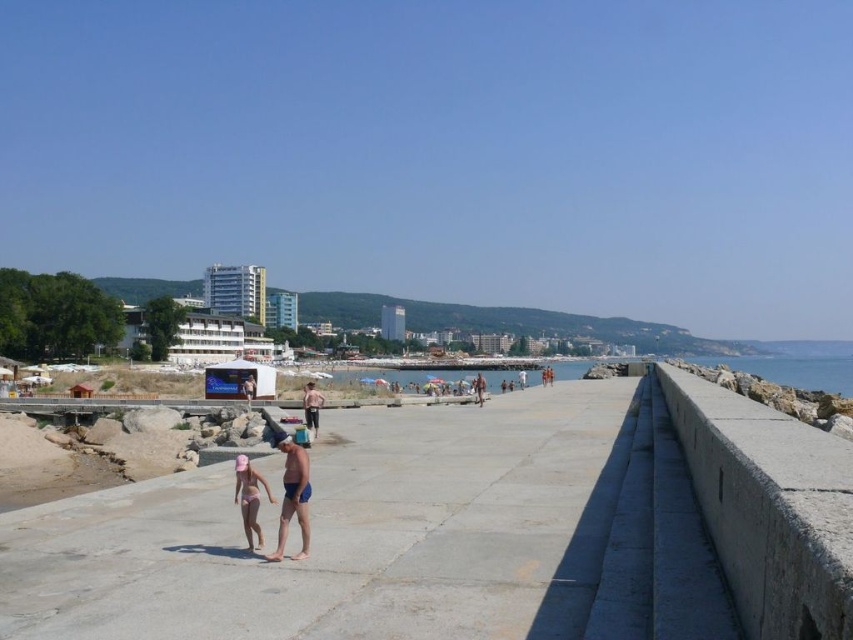
Question: Which of the following is the farthest from the observer?

Choices:
 (A) (299, 477)
 (B) (740, 362)

Answer: (B)

Question: Among these objects, which one is nearest to the camera?

Choices:
 (A) smooth tan skin at center
 (B) pink matte swimsuit at center
 (C) gray concrete ledge at center-right
 (D) smooth concrete pier at center

Answer: (C)

Question: Does smooth tan skin at center appear on the left side of smooth skin person at center?

Choices:
 (A) yes
 (B) no

Answer: (A)

Question: Is smooth concrete pier at center bigger than smooth tan skin at center?

Choices:
 (A) no
 (B) yes

Answer: (B)

Question: Is blue matte shorts at center above pink matte swimsuit at center?

Choices:
 (A) no
 (B) yes

Answer: (A)

Question: Which object is positioned farthest from the smooth skin person at center?

Choices:
 (A) smooth tan skin at center
 (B) gray concrete ledge at center-right
 (C) blue matte shorts at center
 (D) pink matte swimsuit at center

Answer: (A)